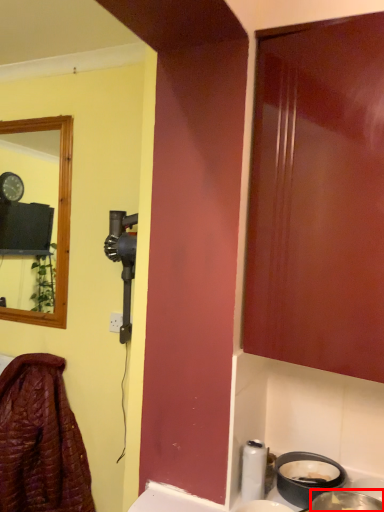
Question: From the image's perspective, what is the correct spatial relationship of basin (annotated by the red box) in relation to laundry?

Choices:
 (A) above
 (B) below

Answer: (A)